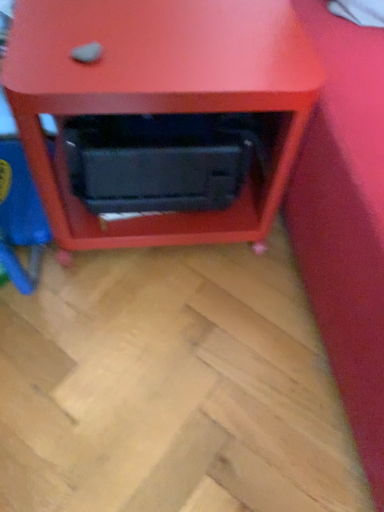
Locate an element on the screen. This screenshot has width=384, height=512. black plastic drawer at center is located at coordinates (156, 162).

Describe the element at coordinates (156, 162) in the screenshot. The width and height of the screenshot is (384, 512). I see `black plastic drawer at center` at that location.

Describe the element at coordinates (160, 98) in the screenshot. I see `matte black microwave at center` at that location.

What are the coordinates of `matte black microwave at center` in the screenshot? It's located at (160, 98).

In order to face matte black microwave at center, should I rotate leftwards or rightwards?

Rotate left and turn 4.603 degrees.

Where is `black plastic drawer at center`? The image size is (384, 512). black plastic drawer at center is located at coordinates (156, 162).

Which is more to the right, black plastic drawer at center or matte black microwave at center?

matte black microwave at center.

Which object is further away from the camera taking this photo, black plastic drawer at center or matte black microwave at center?

black plastic drawer at center is further from the camera.

Which is closer, (213, 120) or (139, 64)?

Point (213, 120).

In the scene shown: From the image's perspective, which is below, black plastic drawer at center or matte black microwave at center?

black plastic drawer at center.

From a real-world perspective, is black plastic drawer at center physically located above or below matte black microwave at center?

From a real-world perspective, black plastic drawer at center is physically below matte black microwave at center.

Is black plastic drawer at center wider than matte black microwave at center?

No, black plastic drawer at center is not wider than matte black microwave at center.

In terms of height, does black plastic drawer at center look taller or shorter compared to matte black microwave at center?

Considering their sizes, black plastic drawer at center has less height than matte black microwave at center.

Based on their sizes in the image, would you say black plastic drawer at center is bigger or smaller than matte black microwave at center?

Clearly, black plastic drawer at center is smaller in size than matte black microwave at center.

Can we say black plastic drawer at center lies outside matte black microwave at center?

No, black plastic drawer at center is inside matte black microwave at center's boundary.

Is black plastic drawer at center in contact with matte black microwave at center?

No.

Looking at this image, is matte black microwave at center at the back of black plastic drawer at center?

Yes, black plastic drawer at center is positioned with its back facing matte black microwave at center.

How many degrees apart are the facing directions of black plastic drawer at center and matte black microwave at center?

The angle between the facing direction of black plastic drawer at center and the facing direction of matte black microwave at center is 7.26e-05 degrees.

Identify the location of furniture that is above the black plastic drawer at center (from a real-world perspective). (160, 98).

Which is more to the left, matte black microwave at center or black plastic drawer at center?

Positioned to the left is black plastic drawer at center.

Is the position of matte black microwave at center more distant than that of black plastic drawer at center?

That is False.

Does point (116, 59) come in front of point (182, 127)?

Yes, point (116, 59) is in front of point (182, 127).

From the image's perspective, who appears lower, matte black microwave at center or black plastic drawer at center?

From the image's view, black plastic drawer at center is below.

From a real-world perspective, is matte black microwave at center on black plastic drawer at center?

Yes, from a real-world perspective, matte black microwave at center is on top of black plastic drawer at center.

Is matte black microwave at center wider than black plastic drawer at center?

Yes, matte black microwave at center is wider than black plastic drawer at center.

Between matte black microwave at center and black plastic drawer at center, which one has less height?

black plastic drawer at center.

Can you confirm if matte black microwave at center is smaller than black plastic drawer at center?

Incorrect, matte black microwave at center is not smaller in size than black plastic drawer at center.

Is matte black microwave at center inside the boundaries of black plastic drawer at center, or outside?

matte black microwave at center is located beyond the bounds of black plastic drawer at center.

Are matte black microwave at center and black plastic drawer at center beside each other?

No, matte black microwave at center is not next to black plastic drawer at center.

Could you tell me if matte black microwave at center is turned towards black plastic drawer at center?

Yes, matte black microwave at center is facing black plastic drawer at center.

Where is `furniture in front of the black plastic drawer at center`? The image size is (384, 512). furniture in front of the black plastic drawer at center is located at coordinates (160, 98).

At what (x,y) coordinates should I click in order to perform the action: click on furniture on the right of black plastic drawer at center. Please return your answer as a coordinate pair (x, y). Image resolution: width=384 pixels, height=512 pixels. Looking at the image, I should click on (160, 98).

The image size is (384, 512). In order to click on furniture that appears in front of the black plastic drawer at center in this screenshot , I will do `click(160, 98)`.